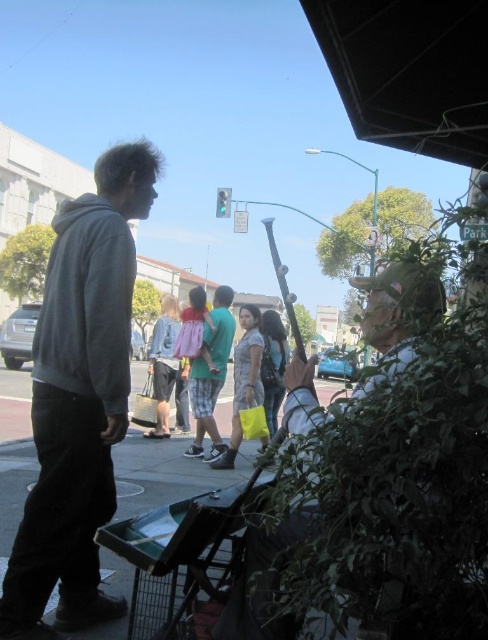
Question: Is gray hoodie at left thinner than leather jacket at center?

Choices:
 (A) no
 (B) yes

Answer: (B)

Question: Considering the relative positions of gray hoodie at left and metallic silver cart at center in the image provided, where is gray hoodie at left located with respect to metallic silver cart at center?

Choices:
 (A) left
 (B) right

Answer: (B)

Question: Among these points, which one is nearest to the camera?

Choices:
 (A) [x=120, y=264]
 (B) [x=271, y=634]

Answer: (B)

Question: Which object is closer to the camera taking this photo?

Choices:
 (A) gray hoodie at left
 (B) leather jacket at center
 (C) metallic silver cart at center

Answer: (B)

Question: Which object appears farthest from the camera in this image?

Choices:
 (A) metallic silver cart at center
 (B) gray hoodie at left
 (C) leather jacket at center

Answer: (B)

Question: Does gray hoodie at left appear on the right side of leather jacket at center?

Choices:
 (A) no
 (B) yes

Answer: (A)